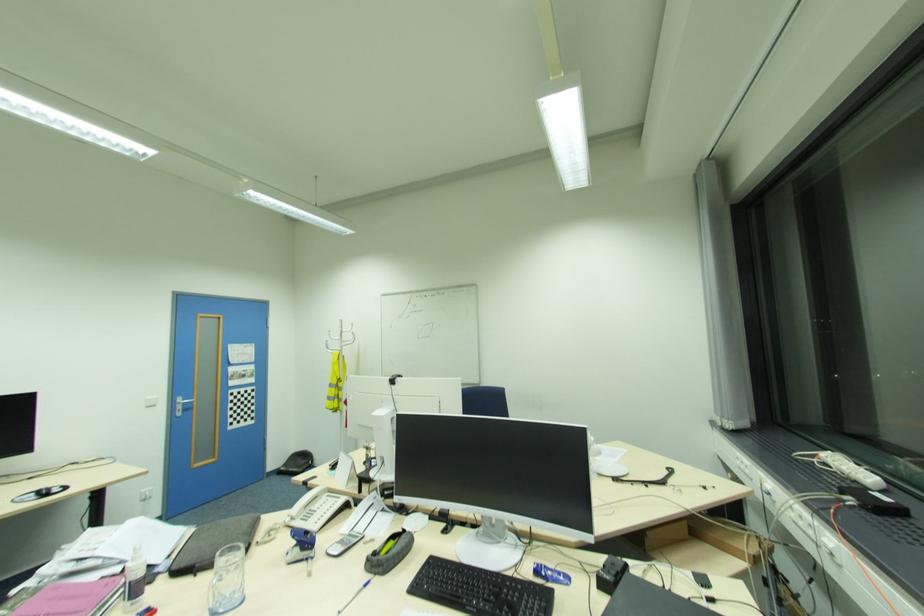
The width and height of the screenshot is (924, 616). Describe the element at coordinates (332, 338) in the screenshot. I see `the coat rack hook` at that location.